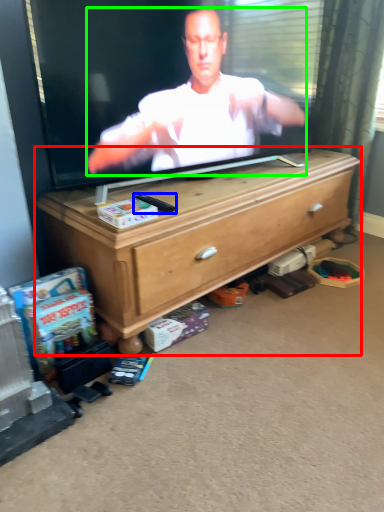
Question: Which is nearer to the chest of drawers (highlighted by a red box)? remote control (highlighted by a blue box) or person (highlighted by a green box).

Choices:
 (A) remote control
 (B) person

Answer: (B)